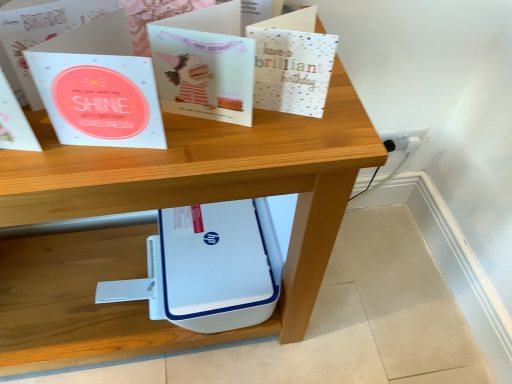
Where is `vacant area in front of light blue paper at center, which is counted as the third paperback book, starting from the right`? The image size is (512, 384). vacant area in front of light blue paper at center, which is counted as the third paperback book, starting from the right is located at coordinates (104, 169).